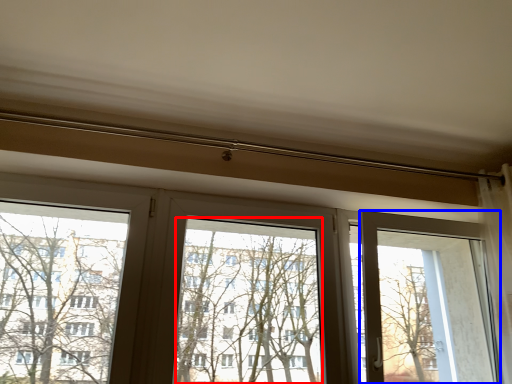
Question: Which point is further to the camera, window screen (highlighted by a red box) or screen door (highlighted by a blue box)?

Choices:
 (A) window screen
 (B) screen door

Answer: (B)